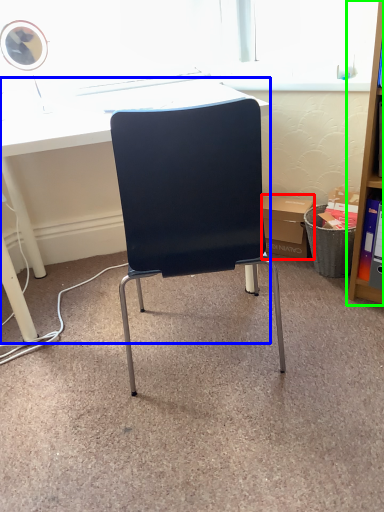
Question: Which is nearer to the box (highlighted by a red box)? desk (highlighted by a blue box) or shelf (highlighted by a green box).

Choices:
 (A) desk
 (B) shelf

Answer: (B)